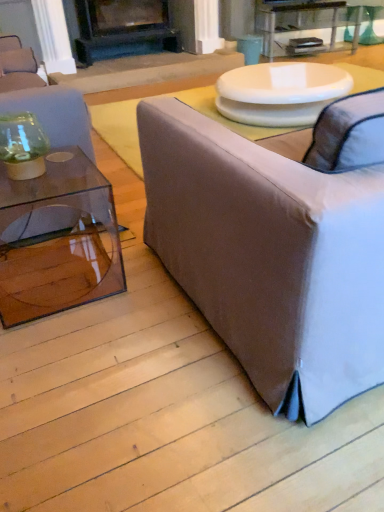
Question: Does point (297, 33) appear closer or farther from the camera than point (82, 49)?

Choices:
 (A) farther
 (B) closer

Answer: (A)

Question: From the image's perspective, is clear glass table at upper center positioned above or below black matte fireplace at upper center?

Choices:
 (A) above
 (B) below

Answer: (B)

Question: Which of these objects is positioned farthest from the black matte fireplace at upper center?

Choices:
 (A) transparent glass vase at left, positioned as the 1th studio couch in left-to-right order
 (B) clear glass table at upper center
 (C) light gray fabric couch at right, acting as the 1th studio couch starting from the right
 (D) white glossy table at upper center
 (E) transparent glass coffee table at left

Answer: (C)

Question: Which object is positioned farthest from the white glossy table at upper center?

Choices:
 (A) light gray fabric couch at right, acting as the 1th studio couch starting from the right
 (B) transparent glass coffee table at left
 (C) clear glass table at upper center
 (D) black matte fireplace at upper center
 (E) transparent glass vase at left, positioned as the 1th studio couch in left-to-right order

Answer: (D)